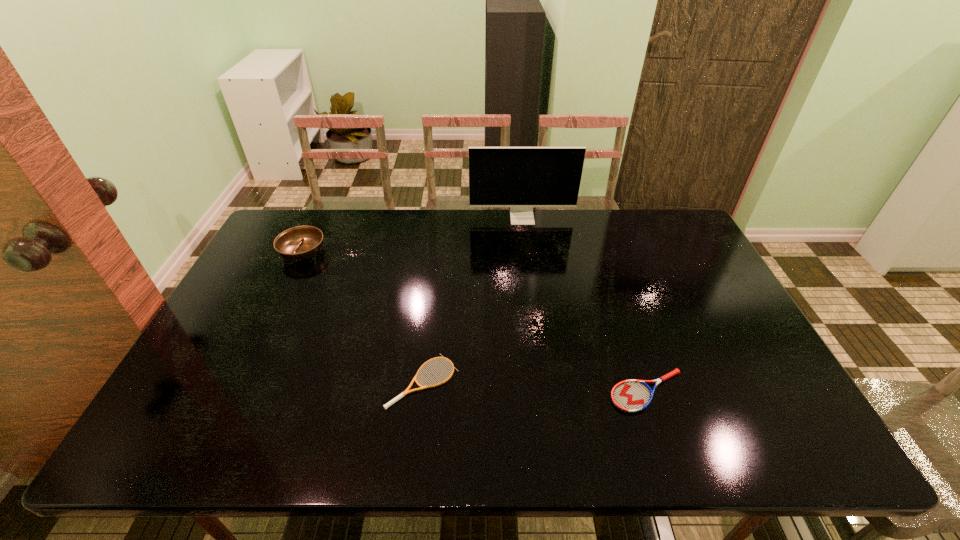
Locate an element on the screen. the farthest object is located at coordinates click(521, 178).

Locate an element on the screen. monitor is located at coordinates (521, 178).

You are a GUI agent. You are given a task and a screenshot of the screen. Output one action in this format:
    pyautogui.click(x=<x>, y=<y>)
    Task: Click on the soup bowl
    The width and height of the screenshot is (960, 540).
    Given the screenshot: What is the action you would take?
    pyautogui.click(x=300, y=243)

What are the coordinates of `the third nearest object` in the screenshot? It's located at 300,243.

Identify the location of the right tennis racket. (631, 396).

The width and height of the screenshot is (960, 540). What are the coordinates of `the second object from left to right` in the screenshot? It's located at (406, 391).

The height and width of the screenshot is (540, 960). Find the location of `vacant space located on the front-facing side of the tallest object`. vacant space located on the front-facing side of the tallest object is located at coordinates (533, 301).

Locate an element on the screen. vacant space situated on the right of the second farthest object is located at coordinates (378, 252).

Where is `free location located on the right of the right tennis racket`? free location located on the right of the right tennis racket is located at coordinates (782, 391).

Identify the location of free space located 0.170m on the left of the left tennis racket. (319, 381).